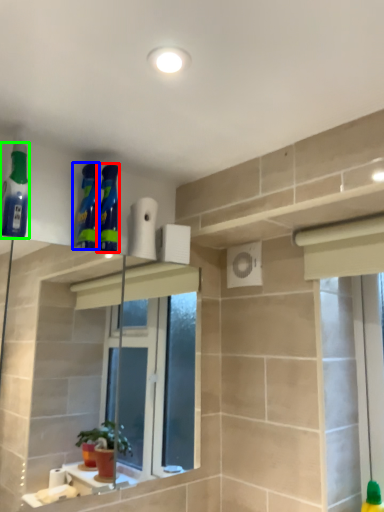
Question: Which object is positioned closest to cleaning product (highlighted by a red box)? Select from cleaning product (highlighted by a blue box) and cleaning product (highlighted by a green box).

Choices:
 (A) cleaning product
 (B) cleaning product

Answer: (A)